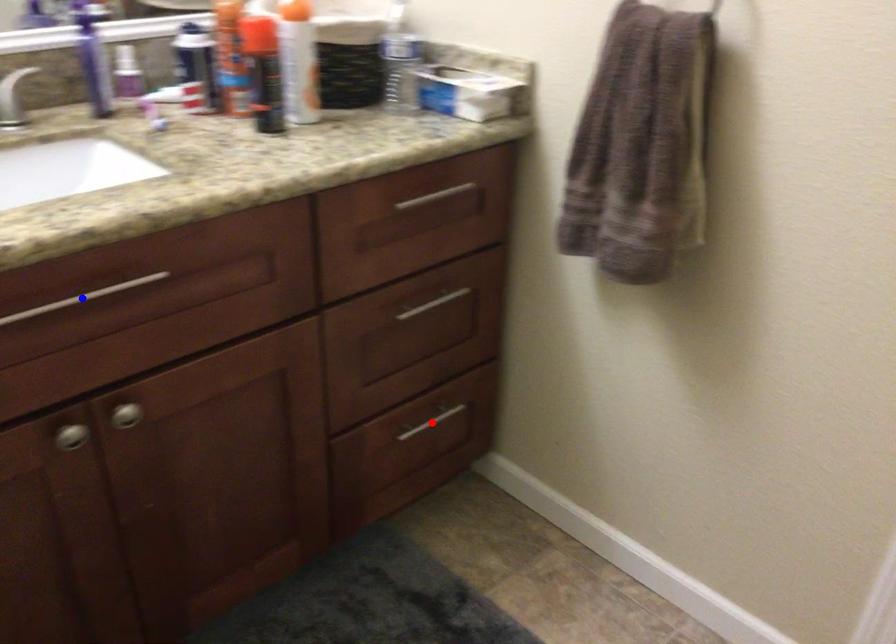
Question: In the image, two points are highlighted. Which point is nearer to the camera? Reply with the corresponding letter.

Choices:
 (A) blue point
 (B) red point

Answer: (A)